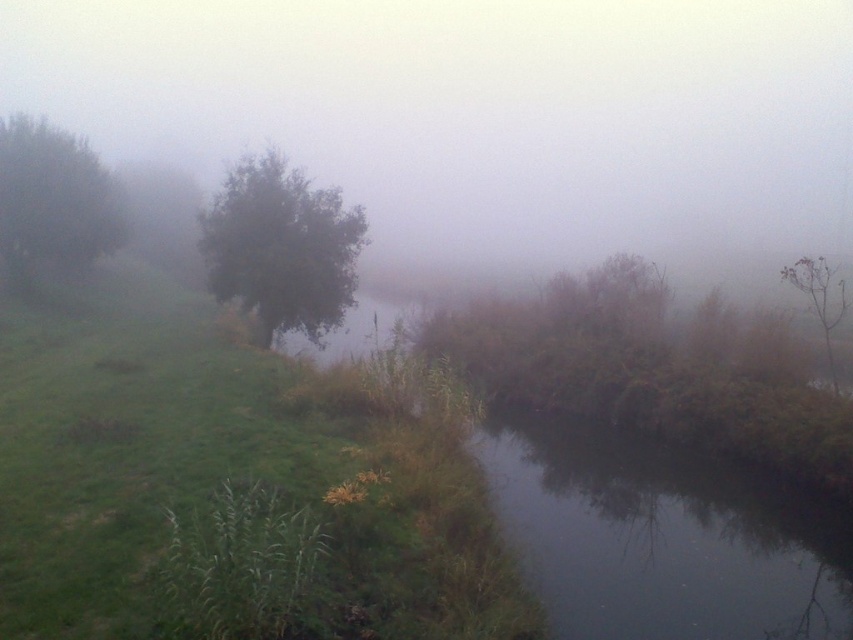
Question: Is green leafy tree at center wider than green matte tree at left?

Choices:
 (A) yes
 (B) no

Answer: (A)

Question: Can you confirm if green leafy tree at center is positioned to the right of green matte tree at left?

Choices:
 (A) yes
 (B) no

Answer: (A)

Question: Considering the real-world distances, which object is farthest from the brown matte tree at upper right?

Choices:
 (A) green leafy tree at center
 (B) green matte tree at left

Answer: (B)

Question: Does green matte tree at left appear on the left side of brown matte tree at upper right?

Choices:
 (A) no
 (B) yes

Answer: (B)

Question: Which is farther from the green matte tree at left?

Choices:
 (A) brown matte tree at upper right
 (B) green leafy tree at center

Answer: (A)

Question: Which of these objects is positioned closest to the green matte tree at left?

Choices:
 (A) brown matte tree at upper right
 (B) green leafy tree at center

Answer: (B)